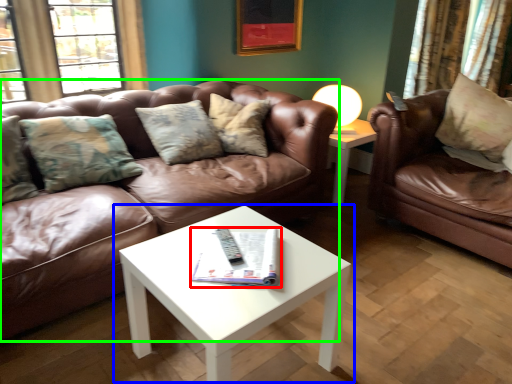
Question: Which object is positioned farthest from magazine (highlighted by a red box)? Select from coffee table (highlighted by a blue box) and studio couch (highlighted by a green box).

Choices:
 (A) coffee table
 (B) studio couch

Answer: (B)